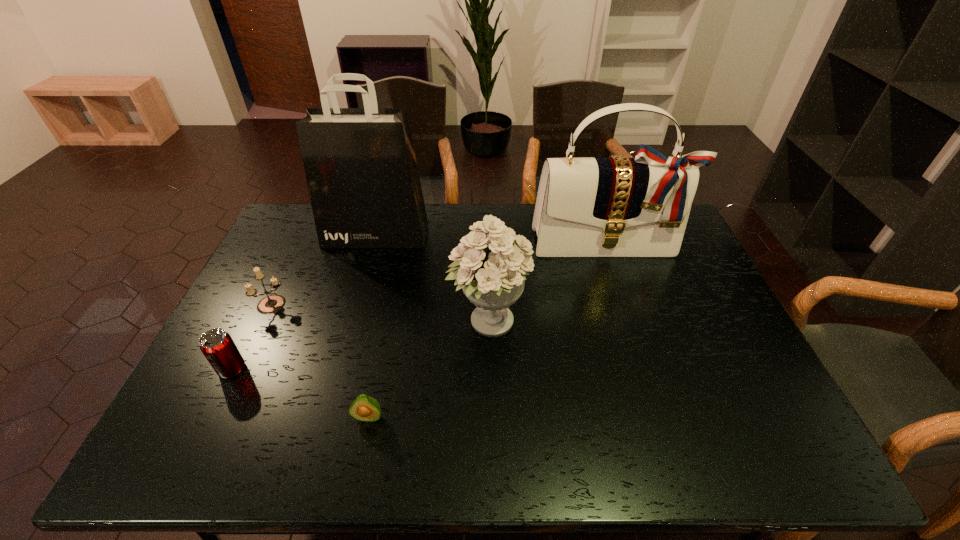
You are a GUI agent. You are given a task and a screenshot of the screen. Output one action in this format:
    pyautogui.click(x=<x>, y=<y>)
    Task: Click on the free spot at the right edge of the desktop
    The image size is (960, 540).
    Given the screenshot: What is the action you would take?
    pyautogui.click(x=692, y=317)

The width and height of the screenshot is (960, 540). In order to click on free space at the far left corner of the desktop in this screenshot , I will do `click(315, 233)`.

You are a GUI agent. You are given a task and a screenshot of the screen. Output one action in this format:
    pyautogui.click(x=<x>, y=<y>)
    Task: Click on the vacant area between the avocado and the shopping bag
    The height and width of the screenshot is (540, 960).
    Given the screenshot: What is the action you would take?
    point(372,326)

Image resolution: width=960 pixels, height=540 pixels. I want to click on vacant region between the shopping bag and the nearest object, so click(372, 326).

The width and height of the screenshot is (960, 540). I want to click on vacant area that lies between the avocado and the fifth farthest object, so click(x=300, y=393).

Where is `vacant area between the soda can and the avocado`? The width and height of the screenshot is (960, 540). vacant area between the soda can and the avocado is located at coordinates (x=300, y=393).

Identify the location of free spot between the bouquet and the candle holder. This screenshot has width=960, height=540. (381, 313).

In order to click on vacant space that's between the avocado and the candle holder in this screenshot , I will do `click(321, 361)`.

Find the location of a particular element. blank region between the candle holder and the avocado is located at coordinates (321, 361).

Locate an element on the screen. Image resolution: width=960 pixels, height=540 pixels. empty space that is in between the rightmost object and the candle holder is located at coordinates (440, 274).